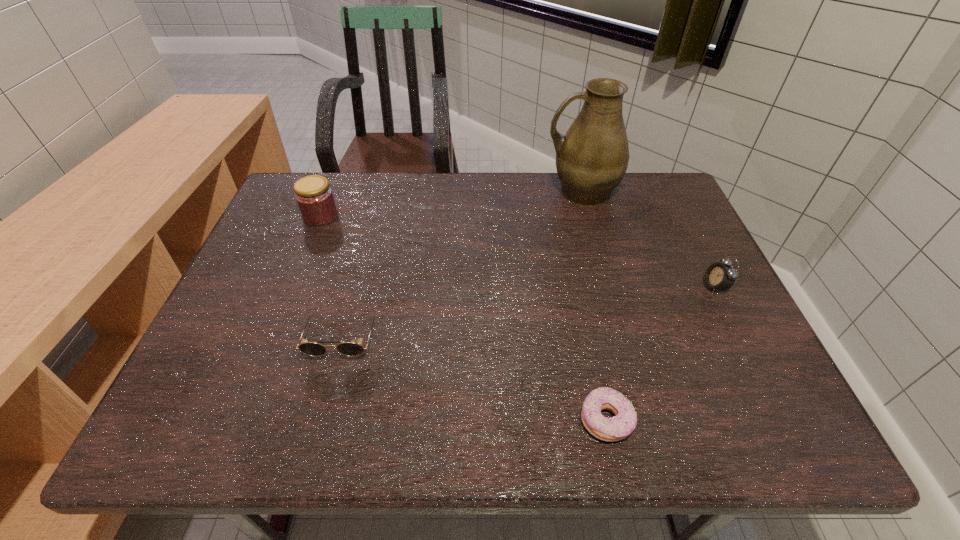
Locate an element on the screen. pitcher is located at coordinates (592, 158).

Image resolution: width=960 pixels, height=540 pixels. I want to click on jam, so click(315, 199).

Where is `the fourth shortest object`? Image resolution: width=960 pixels, height=540 pixels. the fourth shortest object is located at coordinates (315, 199).

What are the coordinates of `the rightmost object` in the screenshot? It's located at (719, 276).

Locate an element on the screen. the third nearest object is located at coordinates (719, 276).

Where is `the second nearest object`? This screenshot has height=540, width=960. the second nearest object is located at coordinates (309, 348).

At what (x,y) coordinates should I click in order to perform the action: click on the fourth tallest object. Please return your answer as a coordinate pair (x, y). The width and height of the screenshot is (960, 540). Looking at the image, I should click on (309, 348).

The width and height of the screenshot is (960, 540). Find the location of `doughnut`. doughnut is located at coordinates (x=616, y=428).

This screenshot has height=540, width=960. Find the location of `the nearest object`. the nearest object is located at coordinates (616, 428).

Identify the location of free region located on the handle side of the pitcher. The width and height of the screenshot is (960, 540). (484, 192).